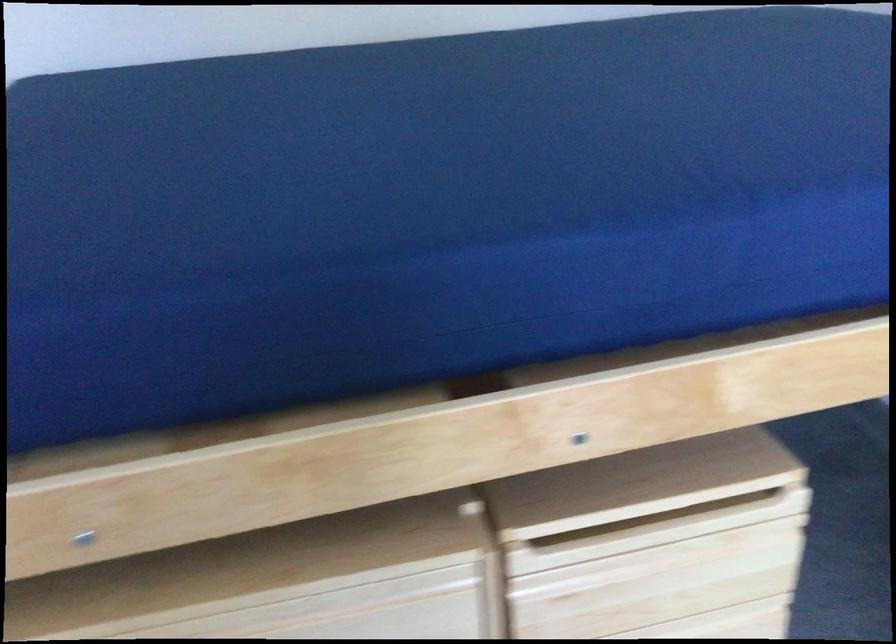
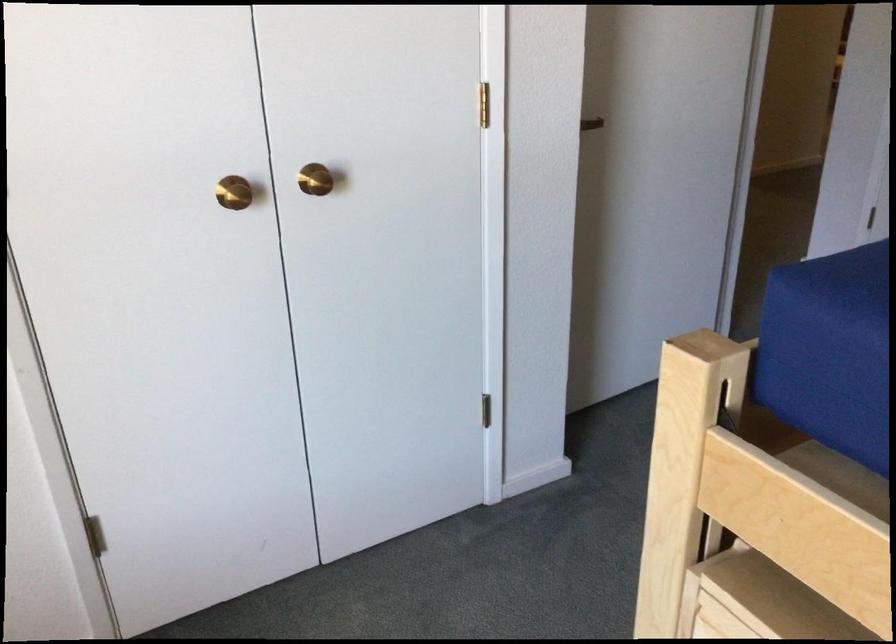
The images are taken continuously from a first-person perspective. In which direction is your viewpoint rotating?

The camera rotated toward left-down.